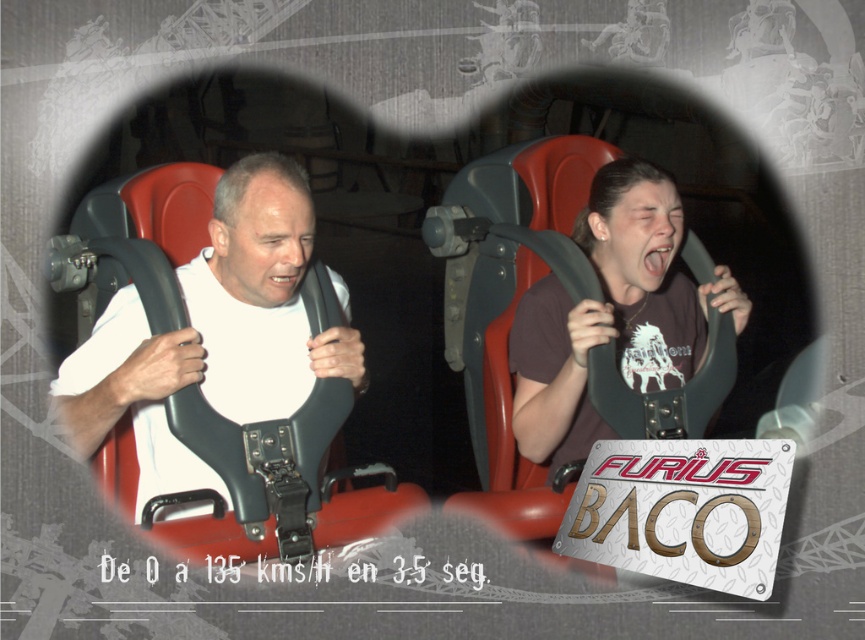
Question: In this image, where is brown matte shirt at center located relative to metallic/textured sign at center-right?

Choices:
 (A) right
 (B) left

Answer: (A)

Question: Which point is farther to the camera?

Choices:
 (A) (343, 337)
 (B) (668, 268)

Answer: (B)

Question: Does matte white shirt at left have a greater width compared to brown matte shirt at center?

Choices:
 (A) yes
 (B) no

Answer: (A)

Question: Which point is farther to the camera?

Choices:
 (A) metallic/textured sign at center-right
 (B) matte white shirt at left
 (C) brown matte shirt at center

Answer: (C)

Question: Estimate the real-world distances between objects in this image. Which object is farther from the brown matte shirt at center?

Choices:
 (A) matte white shirt at left
 (B) metallic/textured sign at center-right

Answer: (A)

Question: Can you confirm if brown matte shirt at center is bigger than metallic/textured sign at center-right?

Choices:
 (A) no
 (B) yes

Answer: (B)